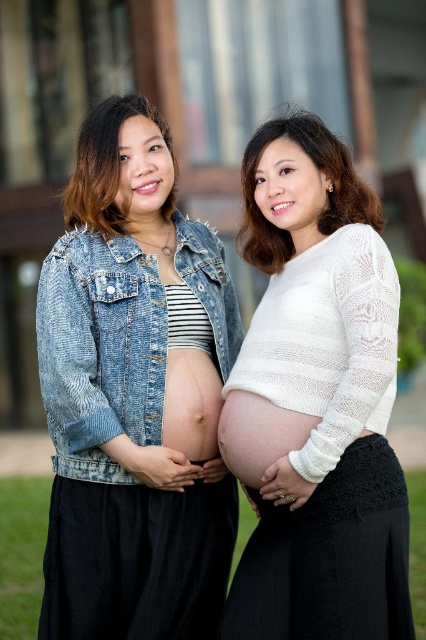
You are a photographer adjusting the camera settings for a maternity photoshoot. You notice two elements at the center of your frame, the white lace sweater at center and the matte skin at center. Which one is taller in the frame?

The white lace sweater at center has a greater height compared to the matte skin at center, so the white lace sweater at center is taller in the frame.

You are a photographer setting up for a maternity photoshoot. You need to position two pregnant women in a way that their outfits are clearly visible. The women are wearing the white knitted sweater at center and the faded denim jacket at lower right. Which outfit should you focus on first to ensure the sweater is in the frame?

The white knitted sweater at center is to the right of the faded denim jacket at lower right. Since the sweater is at the center and to the right of the jacket, you should focus on the faded denim jacket at lower right first to ensure both outfits are framed properly.